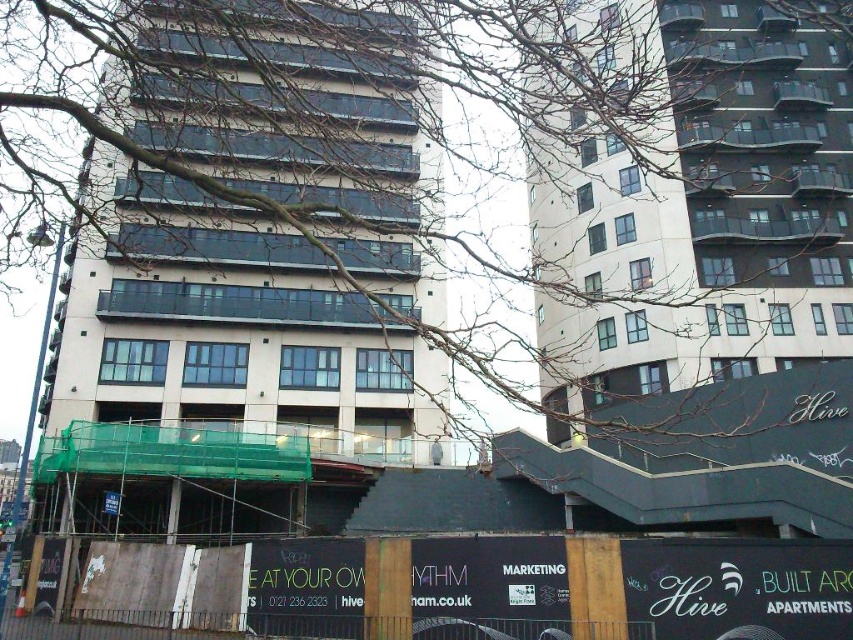
Question: Is beige concrete building at left positioned at the back of smooth concrete building at upper center?

Choices:
 (A) yes
 (B) no

Answer: (B)

Question: Which point is closer to the camera?

Choices:
 (A) (567, 330)
 (B) (305, 496)

Answer: (B)

Question: Does beige concrete building at left have a smaller size compared to smooth concrete building at upper center?

Choices:
 (A) no
 (B) yes

Answer: (A)

Question: Can you confirm if beige concrete building at left is thinner than smooth concrete building at upper center?

Choices:
 (A) no
 (B) yes

Answer: (A)